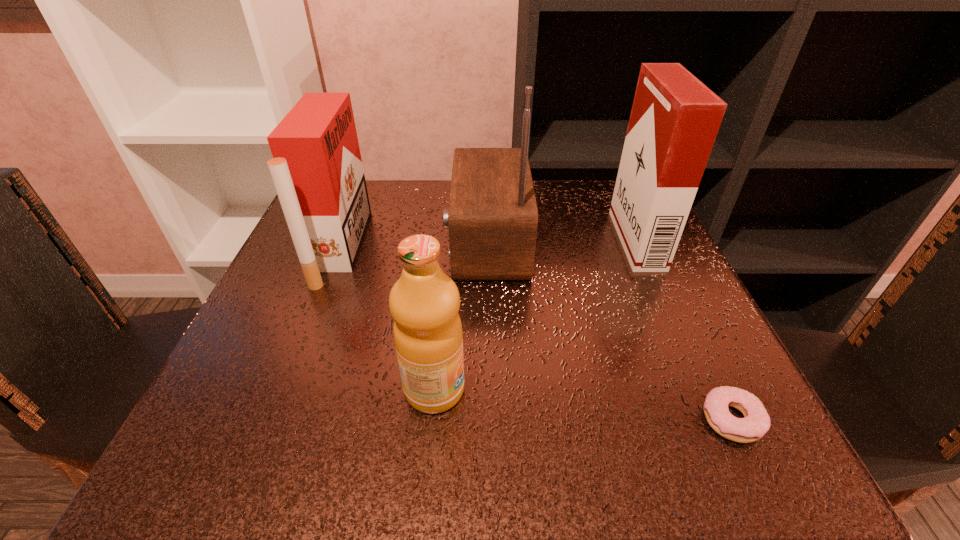
Where is `free point at the near right corner`? This screenshot has width=960, height=540. free point at the near right corner is located at coordinates (643, 414).

Identify the location of vacant area between the fruit juice and the radio receiver. (461, 315).

This screenshot has width=960, height=540. I want to click on vacant region between the leftmost object and the shortest object, so click(x=536, y=334).

Identify the location of free space between the radio receiver and the right cigarette case. (562, 240).

At what (x,y) coordinates should I click in order to perform the action: click on vacant point located between the radio receiver and the fruit juice. Please return your answer as a coordinate pair (x, y). Image resolution: width=960 pixels, height=540 pixels. Looking at the image, I should click on (461, 315).

The image size is (960, 540). Identify the location of free spot between the fruit juice and the doughnut. (583, 404).

Locate an element on the screen. blank region between the doughnut and the right cigarette case is located at coordinates (684, 329).

Identify the location of object that ranks as the fourth closest to the doughnut. (317, 170).

Where is `the fourth closest object to the doughnut`? the fourth closest object to the doughnut is located at coordinates (317, 170).

I want to click on vacant space that satisfies the following two spatial constraints: 1. on the front-facing side of the shortest object; 2. on the left side of the left cigarette case, so click(x=274, y=419).